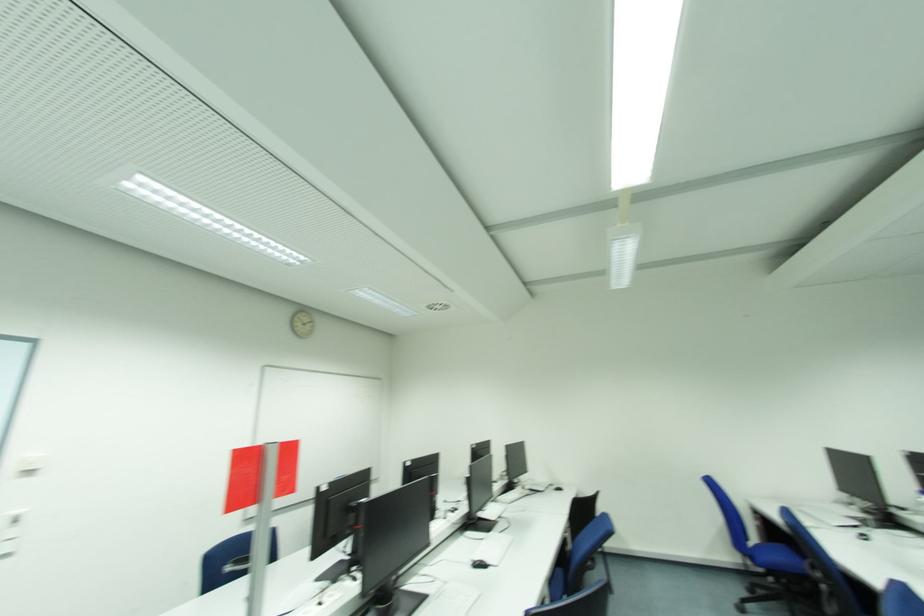
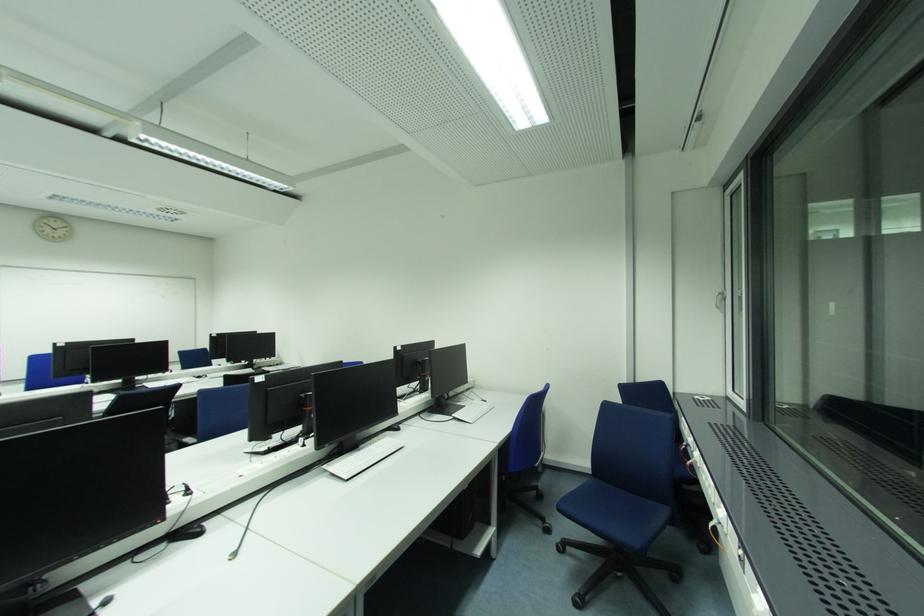
Question: In a continuous first-person perspective shot, in which direction is the camera moving?

Choices:
 (A) Left
 (B) Right
 (C) Forward
 (D) Backward

Answer: (B)